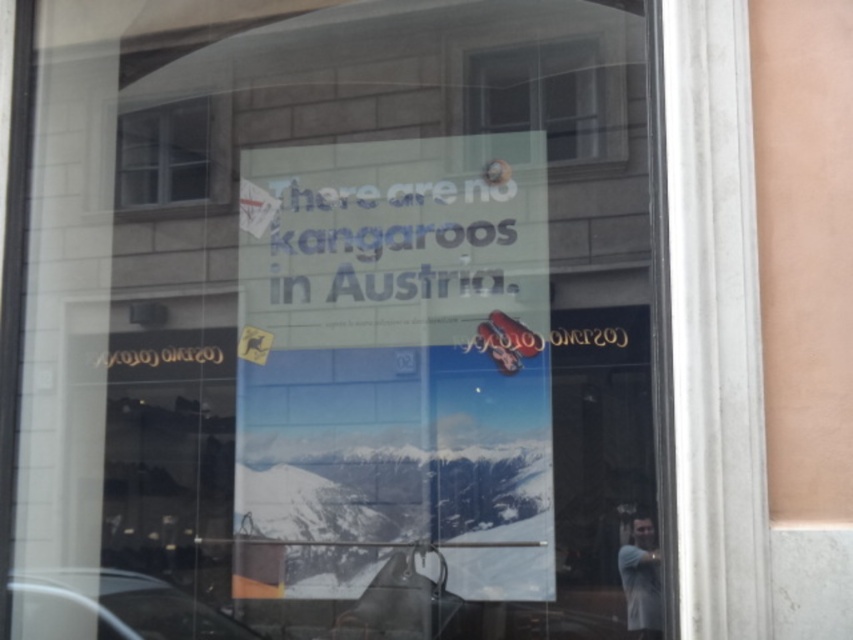
Question: Does transparent glass window at upper center have a greater width compared to white glass window at upper left?

Choices:
 (A) yes
 (B) no

Answer: (A)

Question: Which object is positioned closest to the gray fabric skier at lower right?

Choices:
 (A) transparent glass window at upper center
 (B) white glass window at upper left

Answer: (A)

Question: From the image, what is the correct spatial relationship of white glass window at upper left in relation to gray fabric skier at lower right?

Choices:
 (A) right
 (B) left

Answer: (B)

Question: Which of the following is the farthest from the observer?

Choices:
 (A) white glass window at upper left
 (B) gray fabric skier at lower right
 (C) transparent glass window at upper center

Answer: (A)

Question: From the image, what is the correct spatial relationship of transparent glass window at upper center in relation to gray fabric skier at lower right?

Choices:
 (A) below
 (B) above

Answer: (B)

Question: Estimate the real-world distances between objects in this image. Which object is closer to the transparent glass window at upper center?

Choices:
 (A) white glass window at upper left
 (B) gray fabric skier at lower right

Answer: (A)